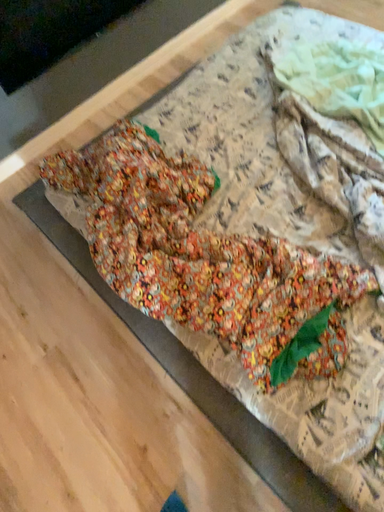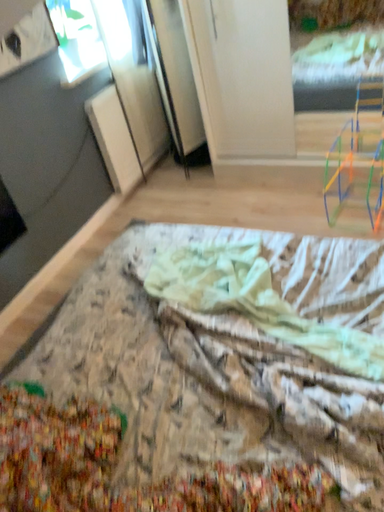
Question: How did the camera likely rotate when shooting the video?

Choices:
 (A) rotated downward
 (B) rotated upward

Answer: (B)